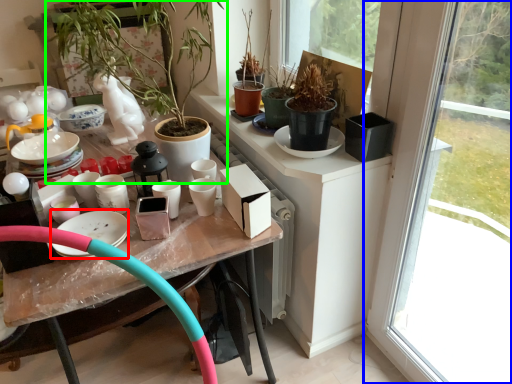
Question: Which is farther away from tableware (highlighted by a red box)? window (highlighted by a blue box) or houseplant (highlighted by a green box)?

Choices:
 (A) window
 (B) houseplant

Answer: (A)